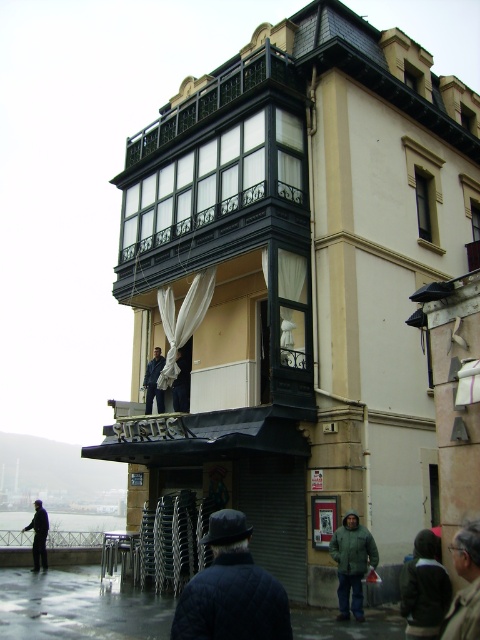
Question: Considering the real-world distances, which object is closest to the dark blue jacket at lower left?

Choices:
 (A) black wrought iron balcony at upper center
 (B) dark gray knit cap at lower right

Answer: (A)

Question: In this image, where is dark blue jacket at lower left located relative to dark blue jacket at center?

Choices:
 (A) above
 (B) below

Answer: (B)

Question: Can you confirm if black wrought iron balcony at upper center is positioned to the left of dark blue jacket at lower left?

Choices:
 (A) yes
 (B) no

Answer: (B)

Question: Which object is closer to the camera taking this photo?

Choices:
 (A) dark blue jacket at center
 (B) green matte jacket at lower center

Answer: (B)

Question: Is black wrought iron balcony at upper center positioned before dark blue jacket at lower left?

Choices:
 (A) no
 (B) yes

Answer: (B)

Question: Which object is farther from the camera taking this photo?

Choices:
 (A) dark blue jacket at lower left
 (B) dark gray knit cap at lower right

Answer: (A)